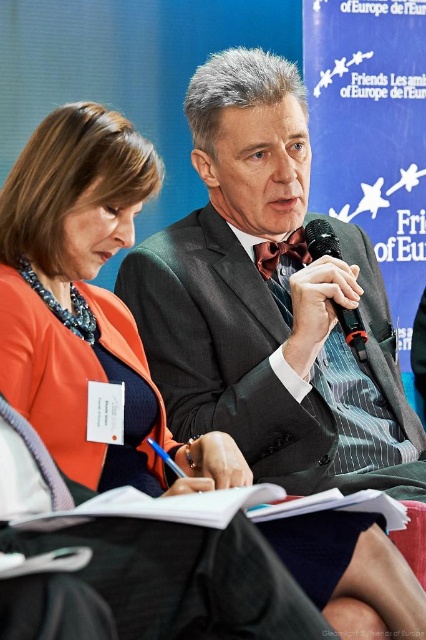
You are attending a conference and need to hand a document to the person closest to you. Based on the image, which individual should you approach? The dark gray suit at center or the black plastic microphone at center?

The dark gray suit at center is closer to the viewer than the black plastic microphone at center, so you should approach the dark gray suit at center.

You are attending a conference and need to locate the speaker. You see the dark gray suit at center and the black plastic microphone at center. Which one is the speaker holding?

The black plastic microphone at center is the one the speaker is holding since it is positioned above the dark gray suit at center, indicating the person wearing the suit is the one holding the microphone.